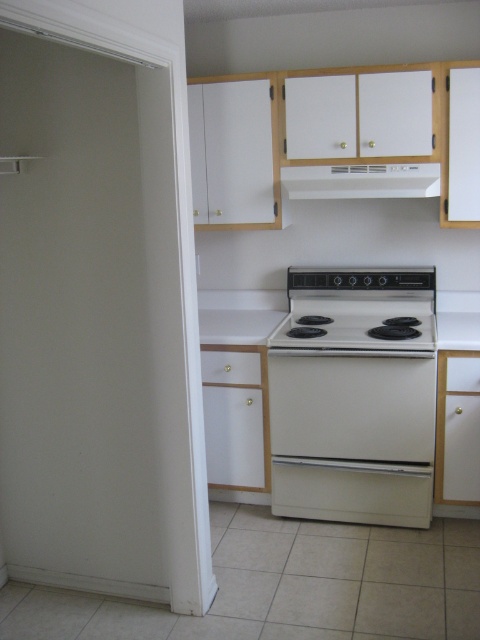
You are a kitchen designer planning to install a new stove and exhaust hood. Based on the image, where should the white glossy electric stove at center be placed in relation to the white matte exhaust hood at upper center?

The white glossy electric stove at center should be placed below the white matte exhaust hood at upper center to ensure proper ventilation and alignment with the existing kitchen design.

You are standing in the kitchen and want to place a small plant between the two points, point (338, 168) and point (387, 328). Which point should you place the plant closer to so that it appears larger in your view?

You should place the plant closer to point (338, 168) because it is closer to the viewer than point (387, 328), so the plant will appear larger when placed nearer to the viewer.

You are standing in the kitchen and need to place a new appliance. The white glossy electric stove at center is currently at position coordinates 0.619, 0.740. If you want to place a new appliance 0.2 meters to the right of the stove, where would the new appliance be positioned?

The new appliance would be positioned at coordinates (355,396) plus 0.2 meters to the right of the white glossy electric stove at center.